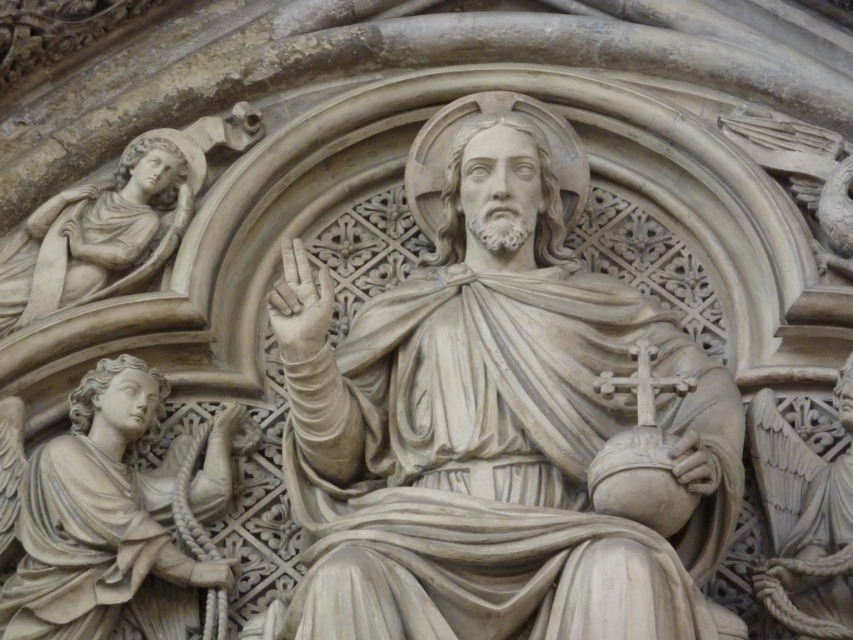
Can you confirm if white marble statue at center is taller than white marble angel at upper left?

Correct, white marble statue at center is much taller as white marble angel at upper left.

In the scene shown: Can you confirm if white marble statue at center is positioned below white marble angel at upper left?

Yes, white marble statue at center is below white marble angel at upper left.

Which is behind, point (740, 486) or point (171, 196)?

Positioned behind is point (171, 196).

You are a GUI agent. You are given a task and a screenshot of the screen. Output one action in this format:
    pyautogui.click(x=<x>, y=<y>)
    Task: Click on the white marble statue at center
    
    Given the screenshot: What is the action you would take?
    pyautogui.click(x=491, y=435)

Is the position of matte stone angel at lower left more distant than that of white marble angel at upper left?

No, matte stone angel at lower left is in front of white marble angel at upper left.

Is point (149, 372) closer to viewer compared to point (41, 205)?

Yes, it is.

The width and height of the screenshot is (853, 640). Identify the location of matte stone angel at lower left. (97, 516).

The width and height of the screenshot is (853, 640). Describe the element at coordinates (97, 516) in the screenshot. I see `matte stone angel at lower left` at that location.

In the scene shown: Measure the distance between matte stone angel at lower left and camera.

matte stone angel at lower left and camera are 73.92 meters apart.

What are the coordinates of `matte stone angel at lower left` in the screenshot? It's located at (97, 516).